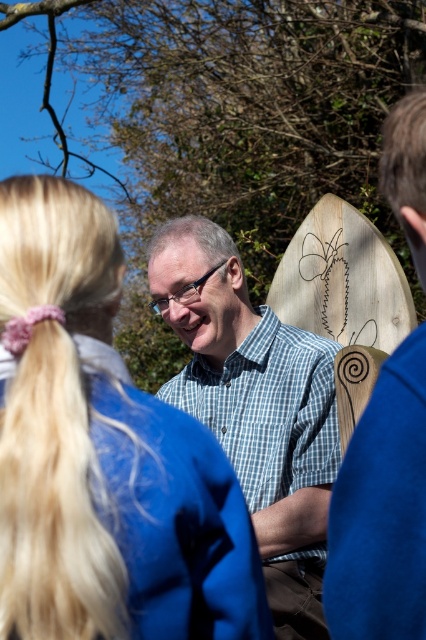
Question: Is the position of blue fabric at center less distant than that of blonde hair at upper left?

Choices:
 (A) no
 (B) yes

Answer: (A)

Question: Is checkered fabric shirt at center to the left of wooden surfboard at right from the viewer's perspective?

Choices:
 (A) yes
 (B) no

Answer: (A)

Question: Among these objects, which one is nearest to the camera?

Choices:
 (A) blue fabric at center
 (B) wooden surfboard at right
 (C) checkered fabric shirt at center
 (D) blonde hair at upper left

Answer: (B)

Question: Does blonde hair at upper left have a lesser width compared to wooden surfboard at right?

Choices:
 (A) no
 (B) yes

Answer: (A)

Question: Which object is the farthest from the wooden surfboard at right?

Choices:
 (A) blue fabric at center
 (B) checkered fabric shirt at center

Answer: (B)

Question: Which of the following is the closest to the observer?

Choices:
 (A) checkered fabric shirt at center
 (B) wooden surfboard at right

Answer: (B)